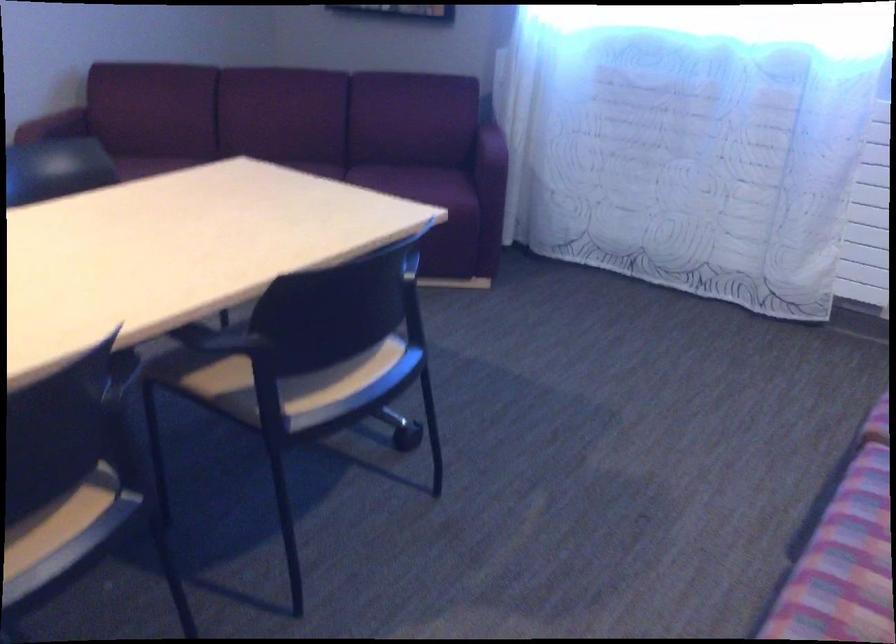
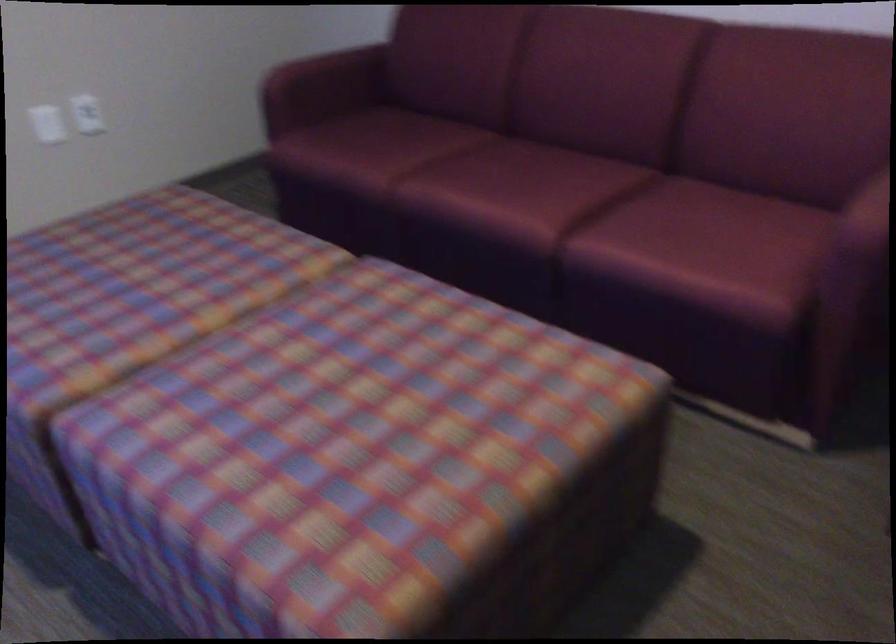
Based on the continuous images, in which direction is the camera rotating?

The camera's rotation is toward right-down.